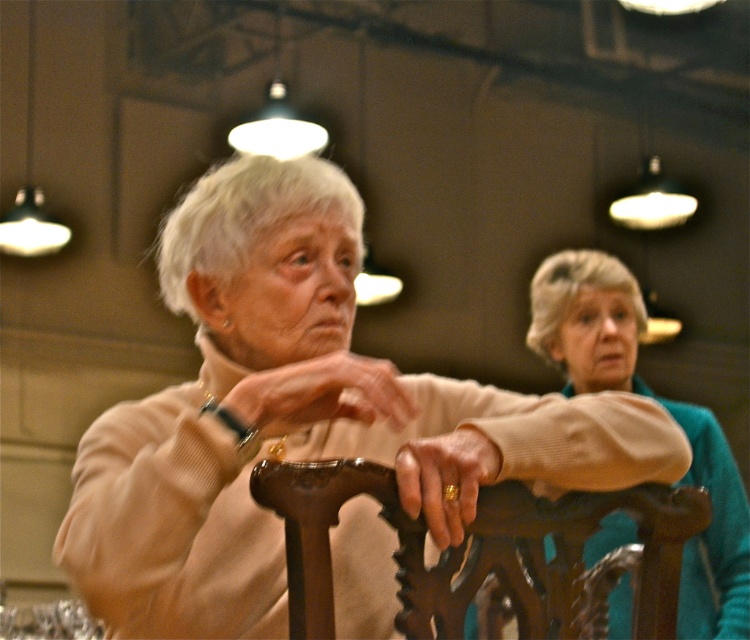
You are an interior designer planning to rearrange the seating in the room. You want to ensure that the polished wood chair at center and the teal sweater at center are visible from the entrance. Given their current positions, which object would you move first to achieve this?

The polished wood chair at center is in front of the teal sweater at center. To ensure both are visible from the entrance, you should move the polished wood chair at center first, as it is currently blocking the view of the teal sweater at center.

You are an interior designer assessing the placement of the matte beige sweater at center in a room. Based on its coordinates at point 0.645, 0.387, can you determine if it is positioned closer to the left or right side of the room?

The matte beige sweater at center is located at point (290, 412). Since the x coordinate is 0.645, which is closer to 1, it is positioned closer to the right side of the room.